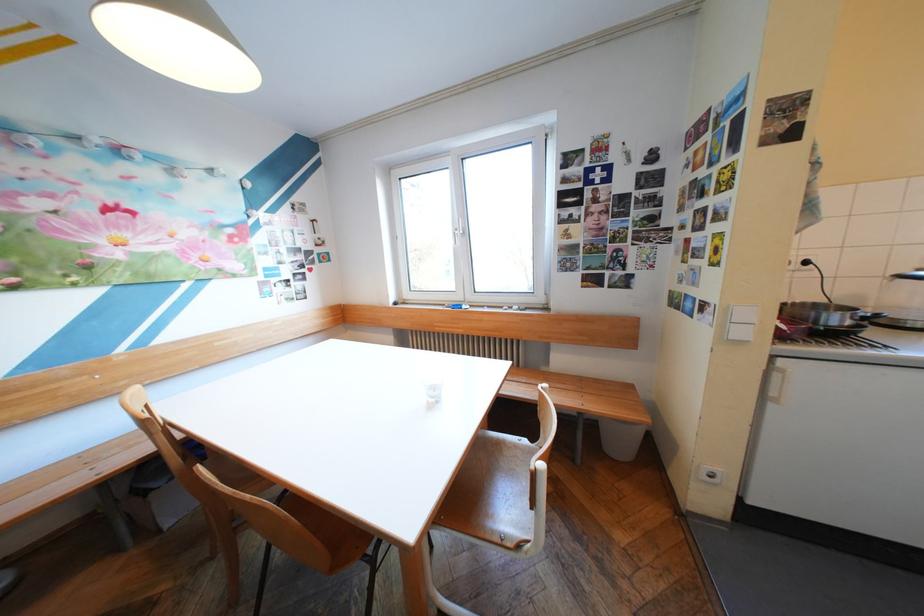
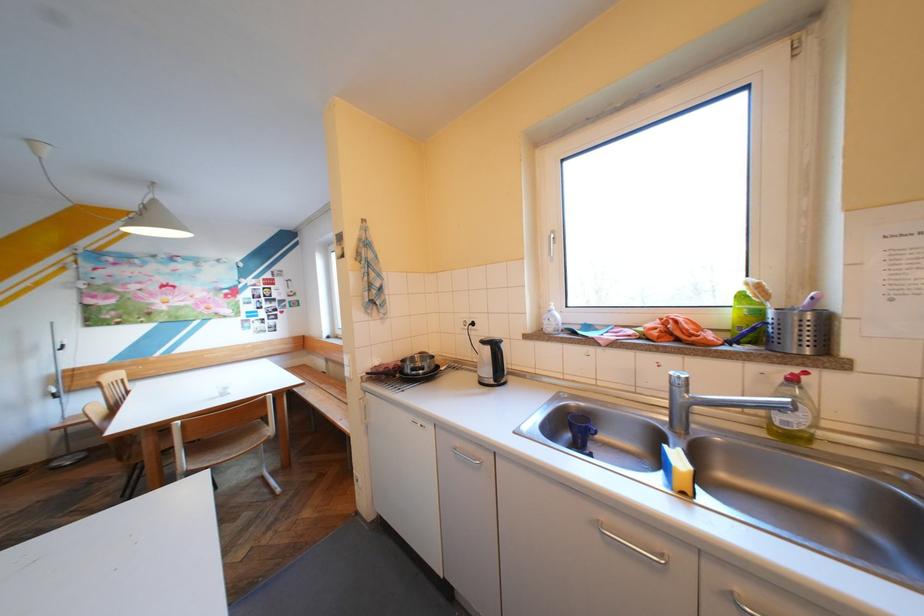
Question: What movement of the cameraman would produce the second image?

Choices:
 (A) Left
 (B) Right
 (C) Forward
 (D) Backward

Answer: (B)